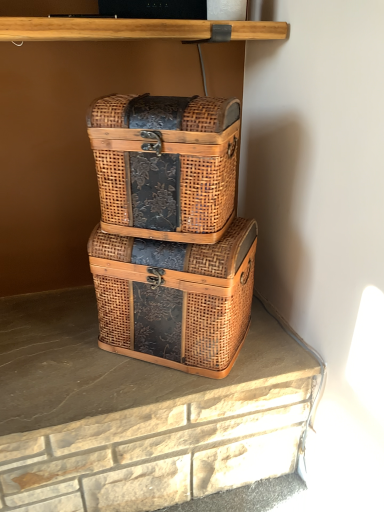
What do you see at coordinates (166, 165) in the screenshot? The height and width of the screenshot is (512, 384). I see `woven wood box at center, which ranks as the 2th box in bottom-to-top order` at bounding box center [166, 165].

Where is `woven wood box at center, the first box from the top`? woven wood box at center, the first box from the top is located at coordinates (166, 165).

Image resolution: width=384 pixels, height=512 pixels. What are the coordinates of `woven wood box at center, the second box viewed from the top` in the screenshot? It's located at (175, 298).

What is the approximate height of woven wood box at center, the second box viewed from the top?

It is 29.61 centimeters.

The width and height of the screenshot is (384, 512). What do you see at coordinates (175, 298) in the screenshot? I see `woven wood box at center, which ranks as the 1th box in bottom-to-top order` at bounding box center [175, 298].

Locate an element on the screen. The image size is (384, 512). woven wood box at center, the first box from the top is located at coordinates (166, 165).

Is woven wood box at center, the second box viewed from the top, at the right side of woven wood box at center, which ranks as the 2th box in bottom-to-top order?

Yes.

In the scene shown: Does woven wood box at center, which ranks as the 1th box in bottom-to-top order, come behind woven wood box at center, the first box from the top?

Yes, it is behind woven wood box at center, the first box from the top.

Which is in front, point (105, 279) or point (202, 187)?

The point (202, 187) is more forward.

From the image's perspective, relative to woven wood box at center, the first box from the top, is woven wood box at center, which ranks as the 1th box in bottom-to-top order, above or below?

Based on their image positions, woven wood box at center, which ranks as the 1th box in bottom-to-top order, is located beneath woven wood box at center, the first box from the top.

From a real-world perspective, is woven wood box at center, which ranks as the 1th box in bottom-to-top order, positioned above or below woven wood box at center, the first box from the top?

woven wood box at center, which ranks as the 1th box in bottom-to-top order, is situated lower than woven wood box at center, the first box from the top, in the real world.

Is woven wood box at center, which ranks as the 1th box in bottom-to-top order, wider or thinner than woven wood box at center, the first box from the top?

woven wood box at center, which ranks as the 1th box in bottom-to-top order, is wider than woven wood box at center, the first box from the top.

In terms of height, does woven wood box at center, which ranks as the 1th box in bottom-to-top order, look taller or shorter compared to woven wood box at center, the first box from the top?

woven wood box at center, which ranks as the 1th box in bottom-to-top order, is taller than woven wood box at center, the first box from the top.

Between woven wood box at center, the second box viewed from the top, and woven wood box at center, which ranks as the 2th box in bottom-to-top order, which one has smaller size?

Smaller between the two is woven wood box at center, which ranks as the 2th box in bottom-to-top order.

Is woven wood box at center, the second box viewed from the top, positioned beyond the bounds of woven wood box at center, the first box from the top?

Yes.

Is woven wood box at center, which ranks as the 1th box in bottom-to-top order, touching woven wood box at center, which ranks as the 2th box in bottom-to-top order?

woven wood box at center, which ranks as the 1th box in bottom-to-top order, and woven wood box at center, which ranks as the 2th box in bottom-to-top order, are clearly separated.

Is woven wood box at center, the second box viewed from the top, looking in the opposite direction of woven wood box at center, which ranks as the 2th box in bottom-to-top order?

That's not correct — woven wood box at center, the second box viewed from the top, is not looking away from woven wood box at center, which ranks as the 2th box in bottom-to-top order.

Can you tell me how much woven wood box at center, which ranks as the 1th box in bottom-to-top order, and woven wood box at center, the first box from the top, differ in facing direction?

There is a 4.59-degree angle between the facing directions of woven wood box at center, which ranks as the 1th box in bottom-to-top order, and woven wood box at center, the first box from the top.

This screenshot has width=384, height=512. I want to click on box behind the woven wood box at center, the first box from the top, so click(x=175, y=298).

Does woven wood box at center, the first box from the top, appear on the right side of woven wood box at center, the second box viewed from the top?

Incorrect, woven wood box at center, the first box from the top, is not on the right side of woven wood box at center, the second box viewed from the top.

Considering the positions of objects woven wood box at center, which ranks as the 2th box in bottom-to-top order, and woven wood box at center, which ranks as the 1th box in bottom-to-top order, in the image provided, who is behind, woven wood box at center, which ranks as the 2th box in bottom-to-top order, or woven wood box at center, which ranks as the 1th box in bottom-to-top order,?

woven wood box at center, which ranks as the 1th box in bottom-to-top order.

Does point (125, 229) come closer to viewer compared to point (239, 292)?

No, (125, 229) is further to viewer.

From the image's perspective, is woven wood box at center, the first box from the top, located beneath woven wood box at center, the second box viewed from the top?

Actually, woven wood box at center, the first box from the top, appears above woven wood box at center, the second box viewed from the top, in the image.

From a real-world perspective, is woven wood box at center, the first box from the top, positioned over woven wood box at center, the second box viewed from the top, based on gravity?

Indeed, from a real-world perspective, woven wood box at center, the first box from the top, stands above woven wood box at center, the second box viewed from the top.

Considering the sizes of objects woven wood box at center, the first box from the top, and woven wood box at center, which ranks as the 1th box in bottom-to-top order, in the image provided, who is wider, woven wood box at center, the first box from the top, or woven wood box at center, which ranks as the 1th box in bottom-to-top order,?

woven wood box at center, which ranks as the 1th box in bottom-to-top order, is wider.

Who is shorter, woven wood box at center, which ranks as the 2th box in bottom-to-top order, or woven wood box at center, the second box viewed from the top?

Standing shorter between the two is woven wood box at center, which ranks as the 2th box in bottom-to-top order.

Considering the sizes of woven wood box at center, which ranks as the 2th box in bottom-to-top order, and woven wood box at center, which ranks as the 1th box in bottom-to-top order, in the image, is woven wood box at center, which ranks as the 2th box in bottom-to-top order, bigger or smaller than woven wood box at center, which ranks as the 1th box in bottom-to-top order,?

In the image, woven wood box at center, which ranks as the 2th box in bottom-to-top order, appears to be smaller than woven wood box at center, which ranks as the 1th box in bottom-to-top order.

Does woven wood box at center, the first box from the top, contain woven wood box at center, the second box viewed from the top?

That's incorrect, woven wood box at center, the second box viewed from the top, is not inside woven wood box at center, the first box from the top.

Can you see woven wood box at center, the first box from the top, touching woven wood box at center, the second box viewed from the top?

There is a gap between woven wood box at center, the first box from the top, and woven wood box at center, the second box viewed from the top.

Could you tell me if woven wood box at center, the first box from the top, is turned towards woven wood box at center, which ranks as the 1th box in bottom-to-top order?

No, woven wood box at center, the first box from the top, is not turned towards woven wood box at center, which ranks as the 1th box in bottom-to-top order.

Consider the image. Can you tell me how much woven wood box at center, the first box from the top, and woven wood box at center, which ranks as the 1th box in bottom-to-top order, differ in facing direction?

woven wood box at center, the first box from the top, and woven wood box at center, which ranks as the 1th box in bottom-to-top order, are facing 4.59 degrees away from each other.

The image size is (384, 512). I want to click on box that is behind the woven wood box at center, which ranks as the 2th box in bottom-to-top order, so (x=175, y=298).

The image size is (384, 512). Find the location of `box that appears below the woven wood box at center, the first box from the top (from the image's perspective)`. box that appears below the woven wood box at center, the first box from the top (from the image's perspective) is located at coordinates (175, 298).

This screenshot has height=512, width=384. What are the coordinates of `box located above the woven wood box at center, the second box viewed from the top (from a real-world perspective)` in the screenshot? It's located at (166, 165).